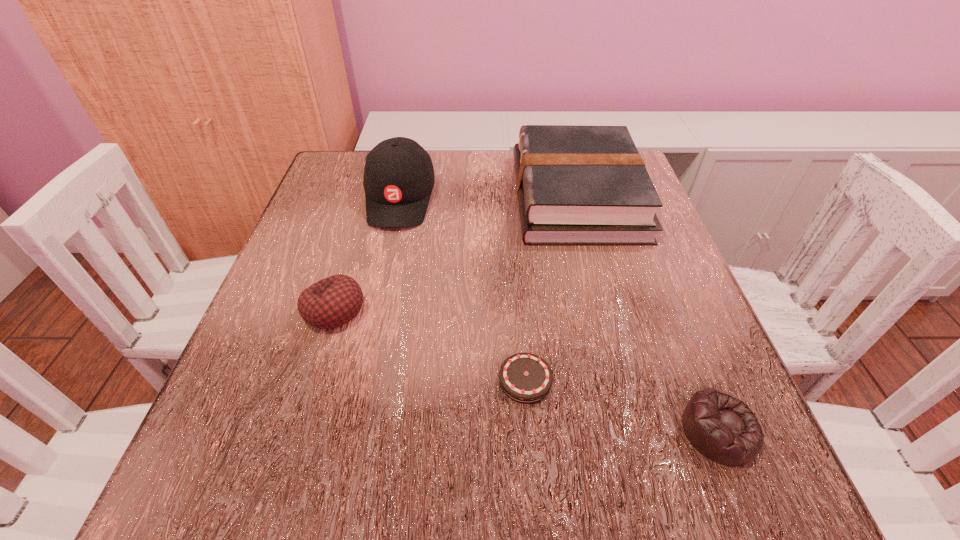
The height and width of the screenshot is (540, 960). Find the location of `empty space between the farther beanbag and the tallest object`. empty space between the farther beanbag and the tallest object is located at coordinates point(367,254).

At what (x,y) coordinates should I click in order to perform the action: click on vacant space in between the tallest object and the shortest object. Please return your answer as a coordinate pair (x, y). This screenshot has height=540, width=960. Looking at the image, I should click on (463, 289).

This screenshot has height=540, width=960. I want to click on unoccupied position between the chocolate cake and the left beanbag, so click(x=430, y=346).

Image resolution: width=960 pixels, height=540 pixels. Identify the location of free space between the hardback book and the farther beanbag. (455, 253).

Identify the location of free space between the right beanbag and the hardback book. (647, 314).

This screenshot has height=540, width=960. I want to click on free space between the second tallest object and the left beanbag, so [455, 253].

The width and height of the screenshot is (960, 540). What are the coordinates of `free space that is in between the right beanbag and the hardback book` in the screenshot? It's located at (647, 314).

Image resolution: width=960 pixels, height=540 pixels. I want to click on object that is the third closest to the chocolate cake, so click(576, 185).

Where is `object that is the fourth nearest to the second tallest object`? The width and height of the screenshot is (960, 540). object that is the fourth nearest to the second tallest object is located at coordinates (722, 428).

At what (x,y) coordinates should I click in order to perform the action: click on free region that satisfies the following two spatial constraints: 1. with a logo on the front of the baseball cap; 2. on the left side of the shorter beanbag. Please return your answer as a coordinate pair (x, y). Image resolution: width=960 pixels, height=540 pixels. Looking at the image, I should click on (348, 430).